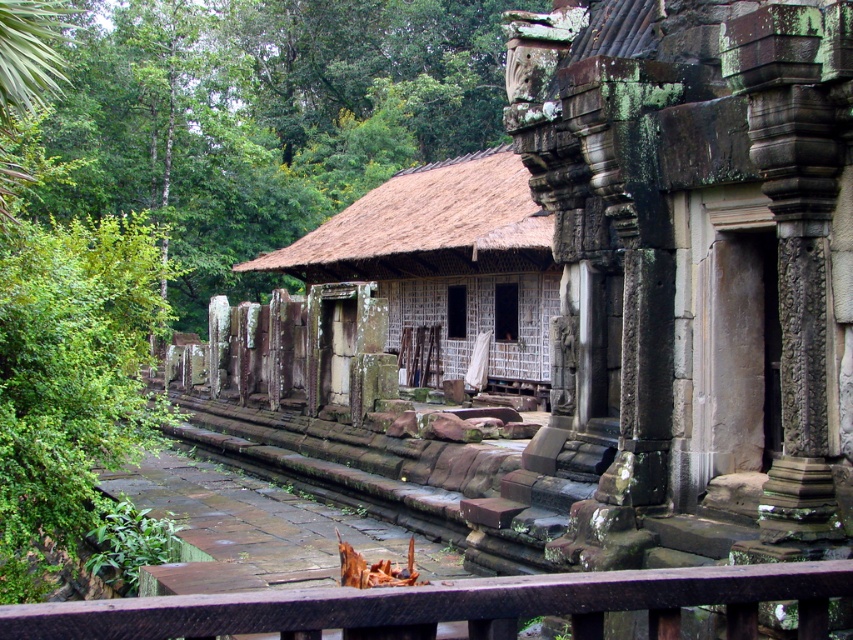
Question: Can you confirm if green leafy vegetation at center is positioned above brown wooden rail at lower center?

Choices:
 (A) no
 (B) yes

Answer: (B)

Question: Is thatched straw hut at center behind brown wooden rail at lower center?

Choices:
 (A) yes
 (B) no

Answer: (A)

Question: Which object is the closest to the brown wooden rail at lower center?

Choices:
 (A) thatched straw hut at center
 (B) green leafy vegetation at center

Answer: (A)

Question: Which point is farther to the camera?

Choices:
 (A) thatched straw hut at center
 (B) brown wooden rail at lower center
 (C) green leafy vegetation at center

Answer: (A)

Question: Which of the following is the closest to the observer?

Choices:
 (A) (453, 253)
 (B) (660, 612)

Answer: (B)

Question: Is green leafy vegetation at center above thatched straw hut at center?

Choices:
 (A) no
 (B) yes

Answer: (B)